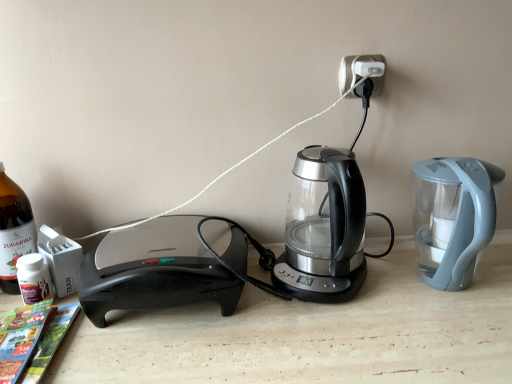
Question: From their relative heights in the image, would you say white plastic electric outlet at upper center is taller or shorter than transparent glass kettle at center?

Choices:
 (A) short
 (B) tall

Answer: (A)

Question: Based on their positions, is white plastic electric outlet at upper center located to the left or right of transparent glass kettle at center?

Choices:
 (A) right
 (B) left

Answer: (A)

Question: Estimate the real-world distances between objects in this image. Which object is farther from the transparent glass kettle at center?

Choices:
 (A) white plastic electric outlet at upper center
 (B) matte paper magazine at lower left
 (C) bottle glass at left

Answer: (C)

Question: Which of these objects is positioned closest to the white plastic electric outlet at upper center?

Choices:
 (A) bottle glass at left
 (B) matte paper magazine at lower left
 (C) transparent glass kettle at center

Answer: (C)